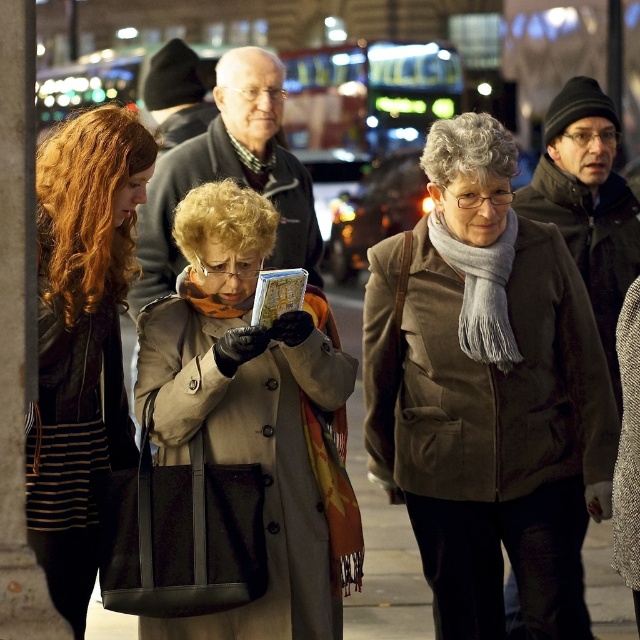
Who is shorter, curly blonde wig at center or gray woolen wig at center?

Standing shorter between the two is gray woolen wig at center.

Between point (193, 188) and point (433, 172), which one is positioned behind?

The point (193, 188) is more distant.

Is point (189, 262) positioned behind point (472, 113)?

Yes.

This screenshot has width=640, height=640. I want to click on curly blonde wig at center, so click(224, 220).

Who is higher up, beige woolen coat at center or dark brown leather coat at center?

dark brown leather coat at center is higher up.

Is beige woolen coat at center smaller than dark brown leather coat at center?

Yes.

What are the coordinates of `beige woolen coat at center` in the screenshot? It's located at (260, 454).

Between point (298, 262) and point (460, 161), which one is positioned behind?

The point (298, 262) is behind.

This screenshot has height=640, width=640. In order to click on beige wool coat at center in this screenshot , I will do (218, 179).